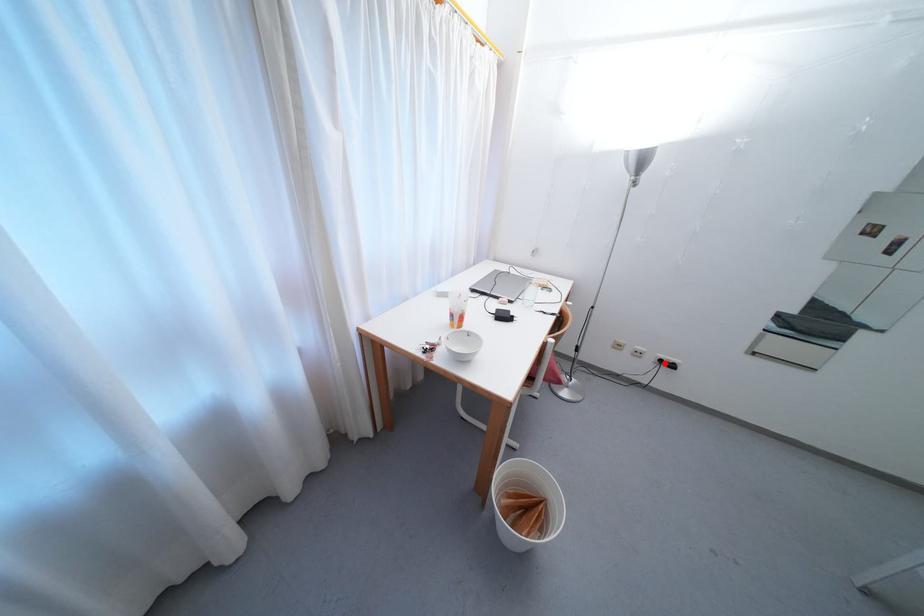
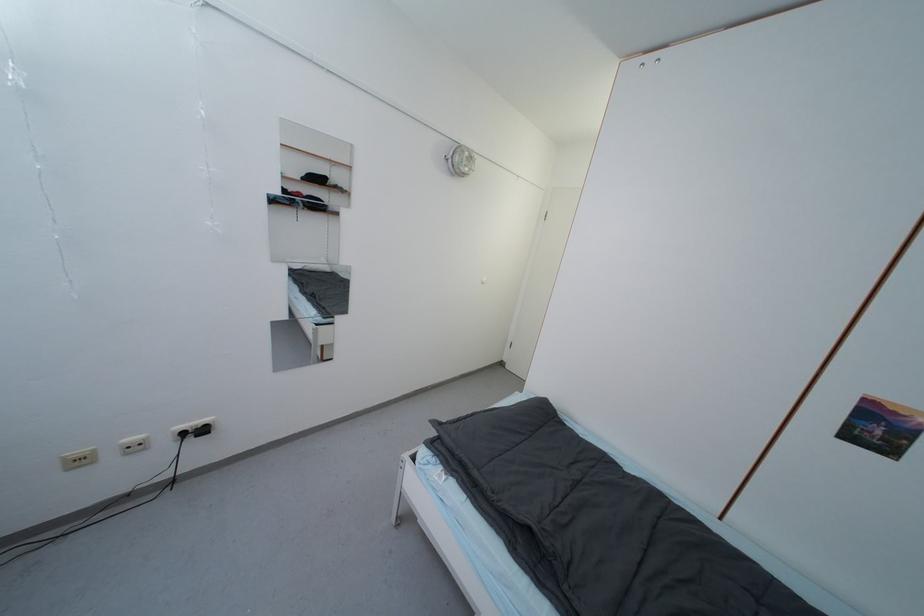
Question: I am providing you with two images of the same scene from different viewpoints. A red point is marked on the first image. Can you still see the location of the red point in image 2?

Choices:
 (A) Yes
 (B) No

Answer: (A)